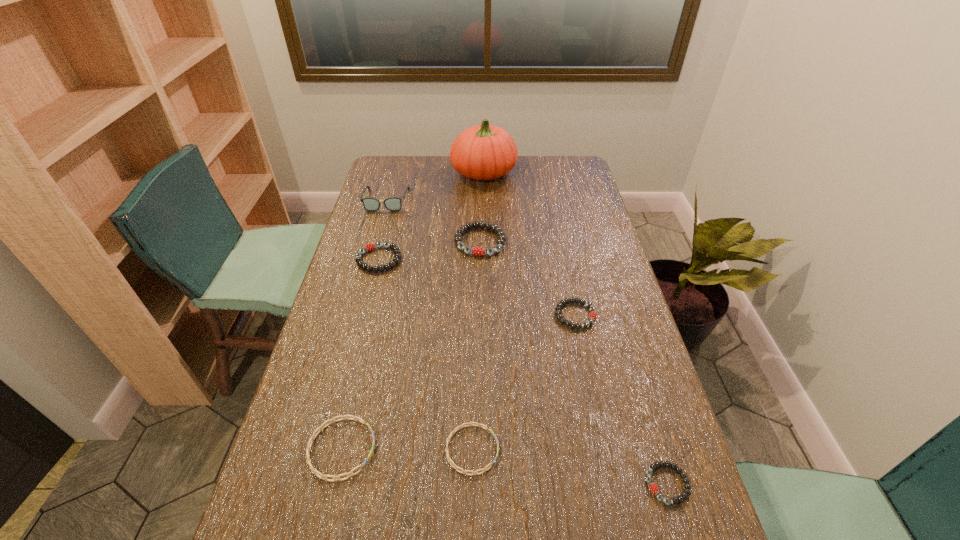
Locate an element on the screen. This screenshot has height=540, width=960. free space between the fourth nearest bracelet and the second biggest black bracelet is located at coordinates tap(477, 287).

Identify the location of free spot between the nearest black bracelet and the third biggest black bracelet. (621, 400).

In order to click on vacant point located between the leftmost black bracelet and the third tallest object in this screenshot , I will do `click(429, 251)`.

Locate which object ranks second in proximity to the orange pumpkin. Please provide its 2D coordinates. Your answer should be formatted as a tuple, i.e. [(x, y)], where the tuple contains the x and y coordinates of a point satisfying the conditions above.

[(477, 251)]

Locate an element on the screen. object that stands as the fourth closest to the tallest bracelet is located at coordinates (483, 152).

Choose which bracelet is the second nearest neighbor to the pumpkin. Please provide its 2D coordinates. Your answer should be formatted as a tuple, i.e. [(x, y)], where the tuple contains the x and y coordinates of a point satisfying the conditions above.

[(368, 247)]

Find the location of a particular element. bracelet that can be found as the closest to the third black bracelet from left to right is located at coordinates (477, 251).

Locate an element on the screen. black bracelet identified as the closest to the tallest bracelet is located at coordinates (368, 247).

This screenshot has height=540, width=960. I want to click on black bracelet that can be found as the closest to the gray spectacles, so click(368, 247).

Where is `blue bracelet that is the second closest to the rightmost object`? blue bracelet that is the second closest to the rightmost object is located at coordinates (356, 418).